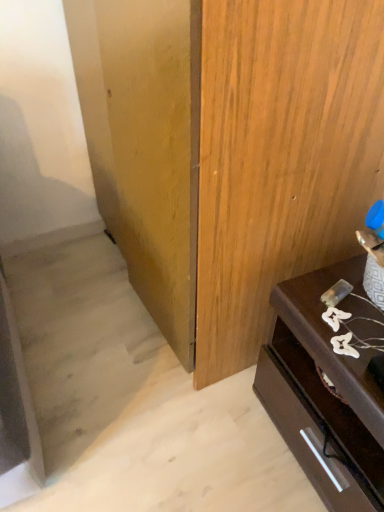
Find the location of a particular element. The height and width of the screenshot is (512, 384). free space to the left of dark brown wood chest of drawers at lower right is located at coordinates (200, 438).